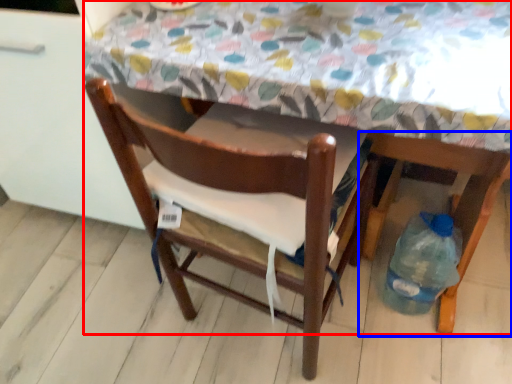
Question: Which object is further to the camera taking this photo, table (highlighted by a red box) or chair (highlighted by a blue box)?

Choices:
 (A) table
 (B) chair

Answer: (B)